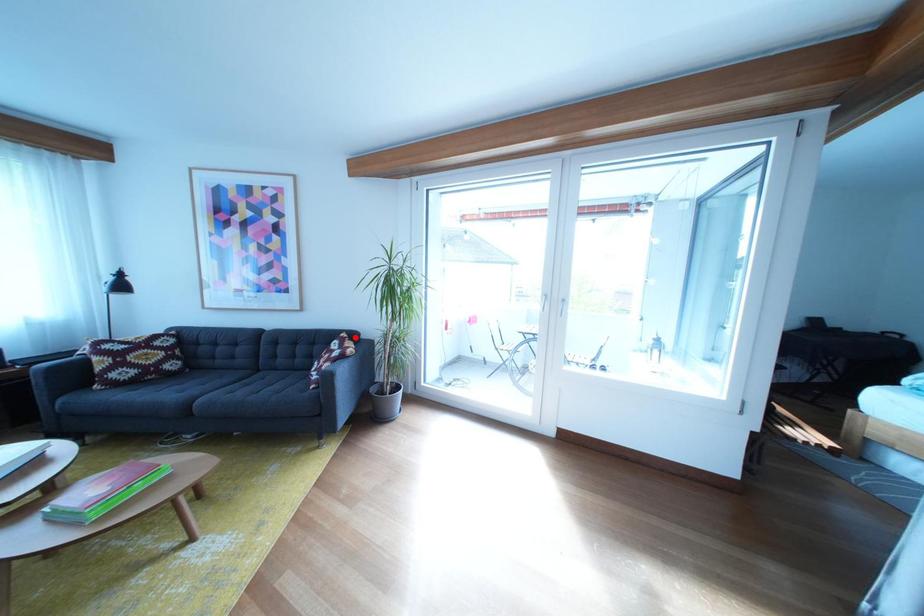
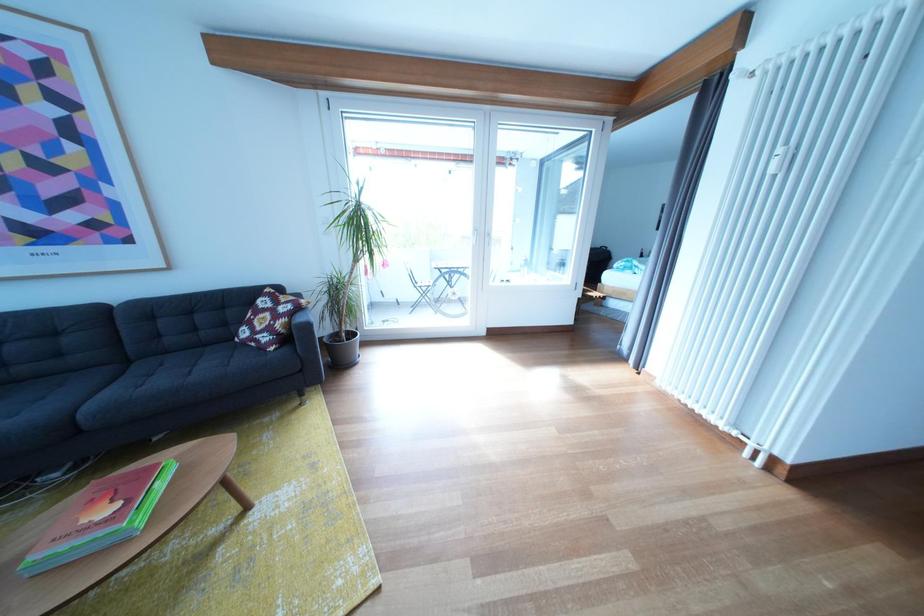
In the second image, find the point that corresponds to the highlighted location in the first image.

(276, 293)